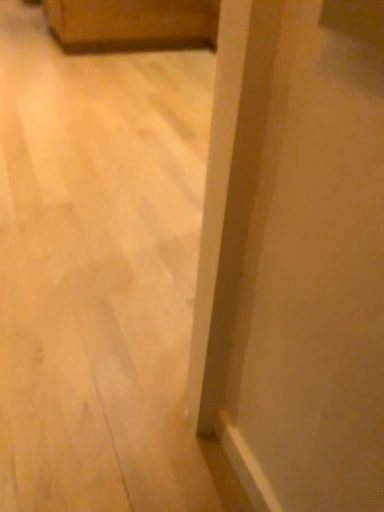
Identify the location of brown leather couch at upper left. This screenshot has height=512, width=384. (132, 24).

What do you see at coordinates (132, 24) in the screenshot? I see `brown leather couch at upper left` at bounding box center [132, 24].

Where is `brown leather couch at upper left`? The image size is (384, 512). brown leather couch at upper left is located at coordinates (132, 24).